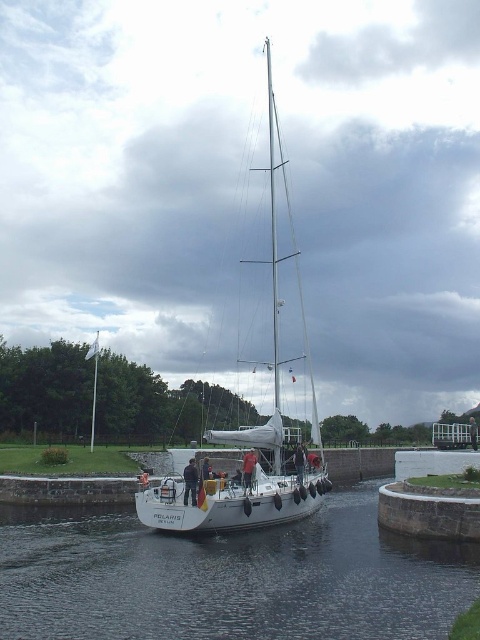
Is dark blue fabric at center wider than brown leather jacket at center?

In fact, dark blue fabric at center might be narrower than brown leather jacket at center.

Between dark blue fabric at center and brown leather jacket at center, which one has less height?

dark blue fabric at center is shorter.

Image resolution: width=480 pixels, height=640 pixels. Find the location of `dark blue fabric at center`. dark blue fabric at center is located at coordinates (249, 468).

Is point (275, 388) closer to viewer compared to point (470, 444)?

That is False.

This screenshot has width=480, height=640. Find the location of `white matte sailboat at center`. white matte sailboat at center is located at coordinates (250, 429).

Does dark blue fabric at center have a smaller size compared to reddish skin human at center?

Incorrect, dark blue fabric at center is not smaller in size than reddish skin human at center.

Is point (250, 449) positioned after point (297, 452)?

That is True.

The width and height of the screenshot is (480, 640). What do you see at coordinates (249, 468) in the screenshot?
I see `dark blue fabric at center` at bounding box center [249, 468].

You are a GUI agent. You are given a task and a screenshot of the screen. Output one action in this format:
    pyautogui.click(x=<x>, y=<y>)
    Task: Click on the dark blue fabric at center
    The image size is (480, 640).
    Given the screenshot: What is the action you would take?
    pyautogui.click(x=249, y=468)